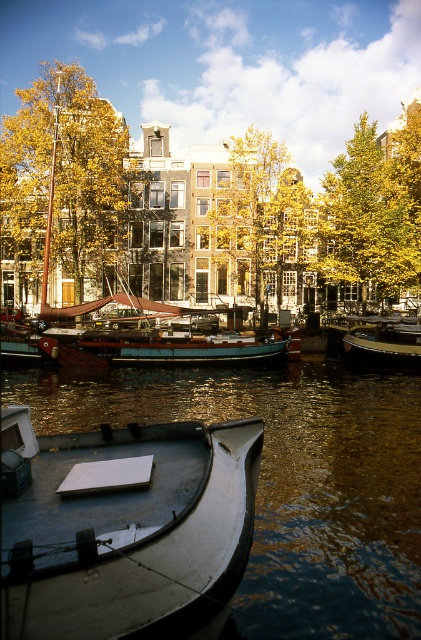
Based on the photo, you are standing on the deck of the white boat in the canal scene. You notice two points marked in the image. Which point is closer to you, point (23,180) or point (402,259)?

Point (23,180) is closer to you because it is further to the camera than point (402,259).

Based on the photo, you are standing at the center of the canal and want to reach the metallic gray boat at lower left. Which direction should you head towards?

You should head towards the lower left direction to reach the metallic gray boat at lower left as it is located at point [130,531].